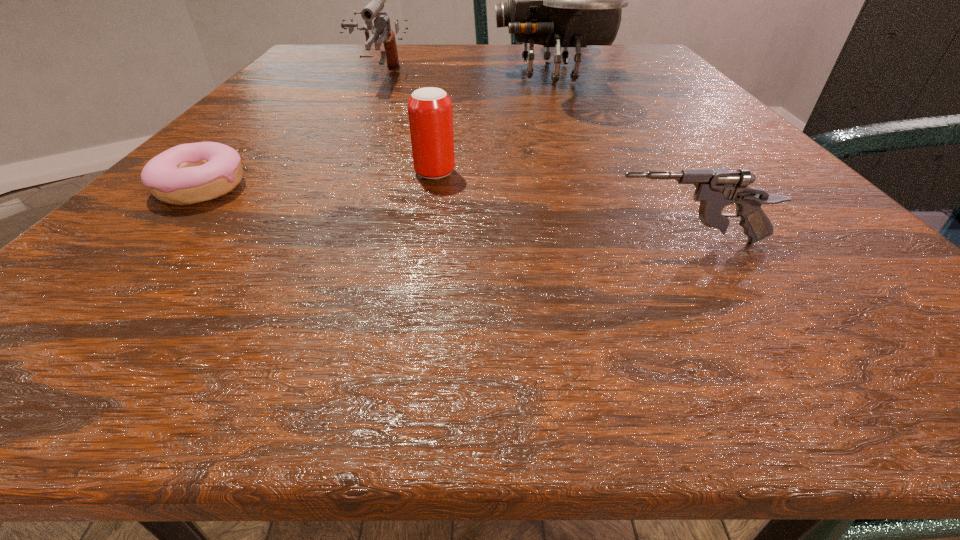
Locate an element on the screen. The image size is (960, 540). drone is located at coordinates (x=557, y=0).

Where is `the left gun`? Image resolution: width=960 pixels, height=540 pixels. the left gun is located at coordinates (381, 27).

Identify the location of the fourth shortest object. The width and height of the screenshot is (960, 540). (381, 27).

Identify the location of the third shortest object. This screenshot has height=540, width=960. (430, 113).

Identify the location of the third object from left to right. This screenshot has width=960, height=540. (430, 113).

Locate an element on the screen. the shorter gun is located at coordinates (715, 189).

This screenshot has width=960, height=540. Find the location of `the right gun`. the right gun is located at coordinates (715, 189).

You are a GUI agent. You are given a task and a screenshot of the screen. Output one action in this format:
    pyautogui.click(x=<x>, y=<y>)
    Task: Click on the shortest object
    The image size is (960, 540).
    Given the screenshot: What is the action you would take?
    pyautogui.click(x=186, y=174)

At what (x,y) coordinates should I click in order to perform the action: click on doughnut. Please return your answer as a coordinate pair (x, y). This screenshot has height=540, width=960. Looking at the image, I should click on (186, 174).

In order to click on free space located on the front-facing side of the drone in this screenshot , I will do click(449, 74).